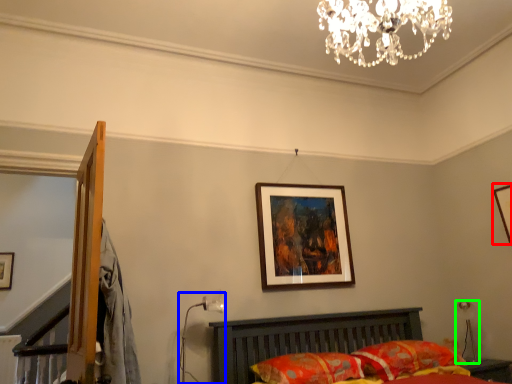
Question: Based on their relative distances, which object is farther from picture frame (highlighted by a red box)? Choose from table lamp (highlighted by a blue box) and table lamp (highlighted by a green box).

Choices:
 (A) table lamp
 (B) table lamp

Answer: (A)